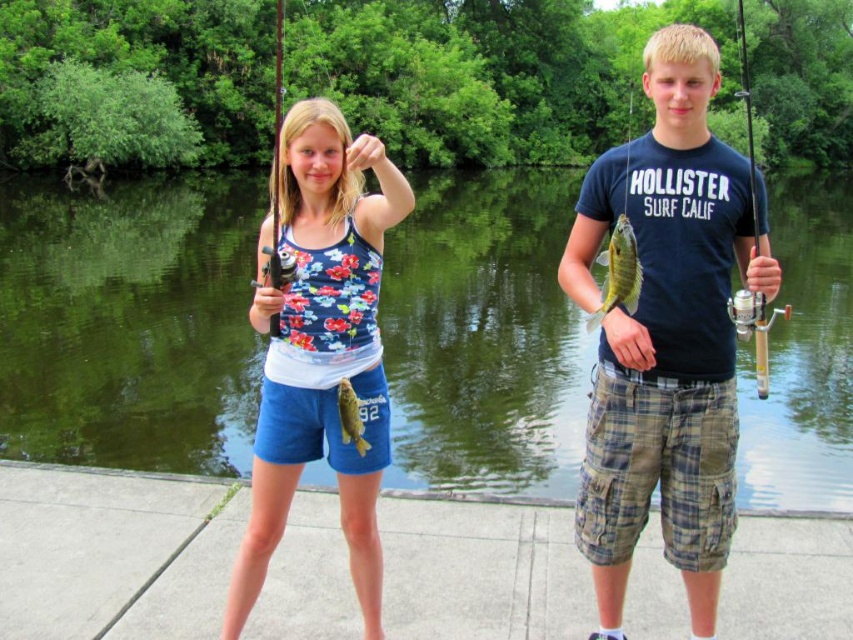
You are a photographer trying to capture the shiny green fish at center and the green smooth water at center in the same frame. Based on their positions, which object should you focus on first to ensure both are in focus?

The shiny green fish at center is behind the green smooth water at center, so you should focus on the shiny green fish at center first to ensure both are in focus.

In the scene, there are a floral fabric tank top at center and a green shiny fish at center. Which object is positioned to the left?

The floral fabric tank top at center is to the left of the green shiny fish at center.

You are a photographer trying to capture the shiny green fish at center without the matte black fishing pole at left blocking the view. Can you move to the right side of the scene to take the photo?

The shiny green fish at center is behind the matte black fishing pole at left, so moving to the right side of the scene might allow you to position yourself around the pole to get a clear view of the fish.